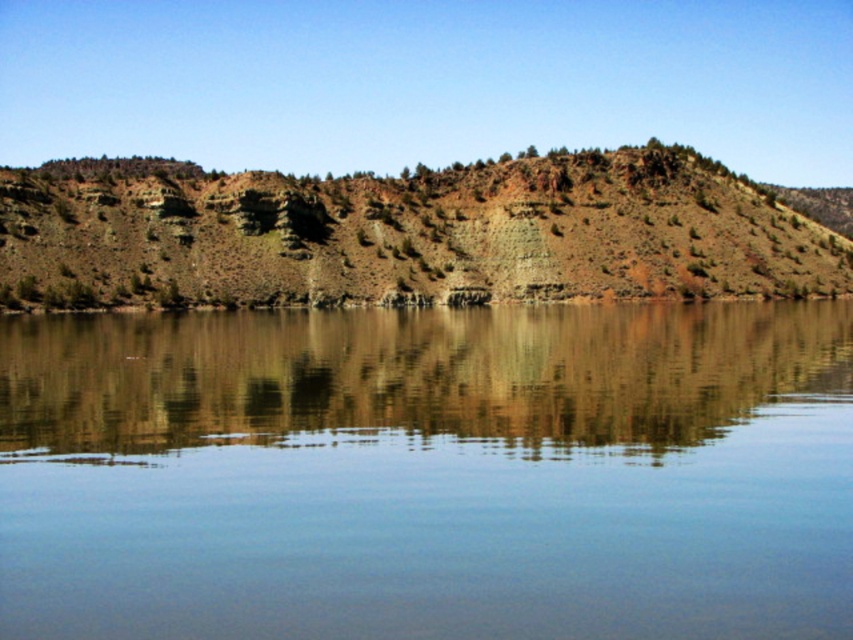
Can you confirm if rustic rock formation at center is smaller than brown matte rock at center?

Actually, rustic rock formation at center might be larger than brown matte rock at center.

Is rustic rock formation at center shorter than brown matte rock at center?

No, rustic rock formation at center is not shorter than brown matte rock at center.

Who is more forward, (248, 282) or (416, 390)?

Point (416, 390)

Identify the location of rustic rock formation at center. The height and width of the screenshot is (640, 853). (405, 234).

Based on the photo, between clear glass water at center and brown matte rock at center, which one is positioned higher?

brown matte rock at center

Is clear glass water at center to the right of brown matte rock at center from the viewer's perspective?

No, clear glass water at center is not to the right of brown matte rock at center.

Is point (836, 532) closer to camera compared to point (242, 372)?

Yes, it is in front of point (242, 372).

Locate an element on the screen. This screenshot has height=640, width=853. clear glass water at center is located at coordinates (428, 474).

Is clear glass water at center smaller than rustic rock formation at center?

Yes, clear glass water at center is smaller than rustic rock formation at center.

Can you confirm if clear glass water at center is bigger than rustic rock formation at center?

Actually, clear glass water at center might be smaller than rustic rock formation at center.

Is point (816, 483) behind point (28, 209)?

No, (816, 483) is in front of (28, 209).

Locate an element on the screen. This screenshot has width=853, height=640. clear glass water at center is located at coordinates (428, 474).